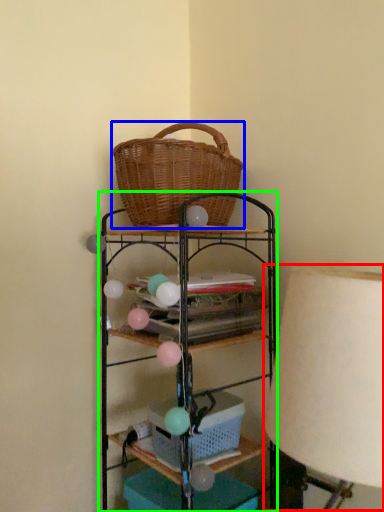
Question: Which object is positioned closest to table lamp (highlighted by a red box)? Select from picnic basket (highlighted by a blue box) and shelf (highlighted by a green box).

Choices:
 (A) picnic basket
 (B) shelf

Answer: (B)